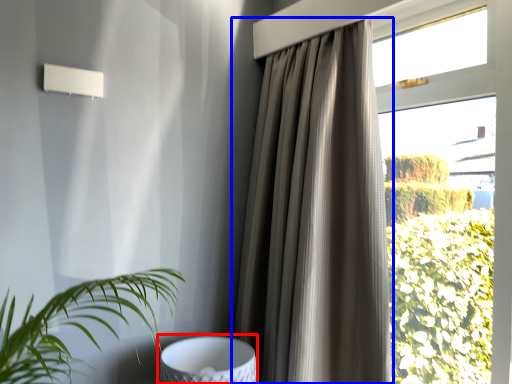
Question: Which object appears closest to the camera in this image, swivel chair (highlighted by a red box) or curtain (highlighted by a blue box)?

Choices:
 (A) swivel chair
 (B) curtain

Answer: (B)